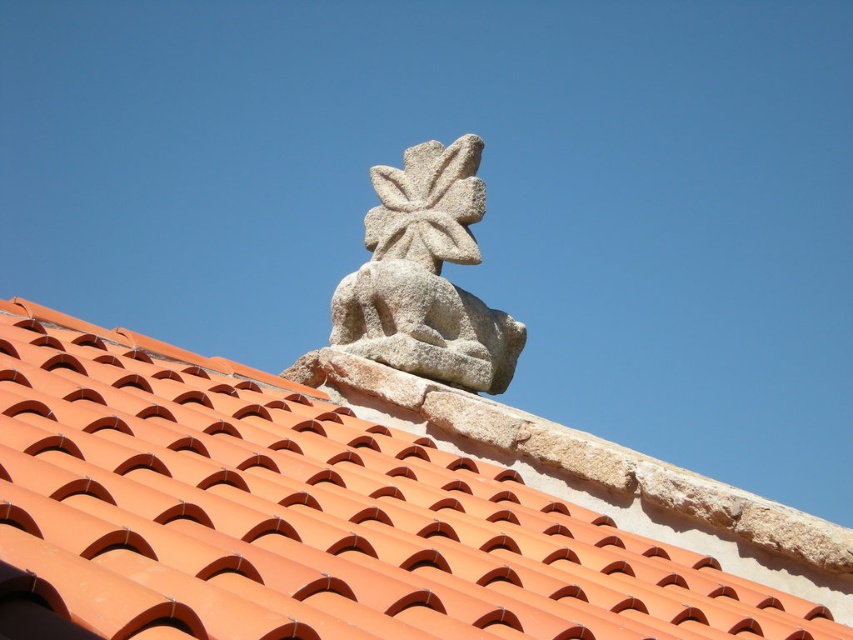
Question: Can you confirm if orange clay tiles at upper center is wider than granite statue at upper center?

Choices:
 (A) yes
 (B) no

Answer: (A)

Question: Does orange clay tiles at upper center appear over granite statue at upper center?

Choices:
 (A) no
 (B) yes

Answer: (A)

Question: Does orange clay tiles at upper center appear under granite statue at upper center?

Choices:
 (A) no
 (B) yes

Answer: (B)

Question: Which point appears closest to the camera in this image?

Choices:
 (A) (416, 256)
 (B) (268, 525)

Answer: (B)

Question: Which of the following is the farthest from the observer?

Choices:
 (A) granite statue at upper center
 (B) orange clay tiles at upper center

Answer: (A)